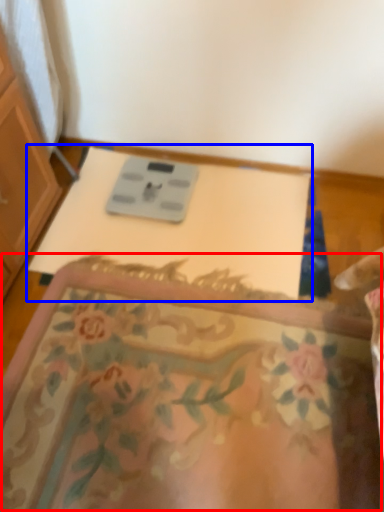
Question: Which object is closer to the camera taking this photo, mat (highlighted by a red box) or changing table (highlighted by a blue box)?

Choices:
 (A) mat
 (B) changing table

Answer: (A)